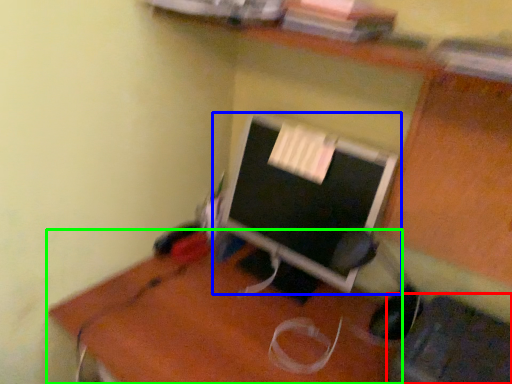
Question: Which object is positioned farthest from computer chair (highlighted by a red box)? Select from computer monitor (highlighted by a blue box) and desk (highlighted by a green box).

Choices:
 (A) computer monitor
 (B) desk

Answer: (A)